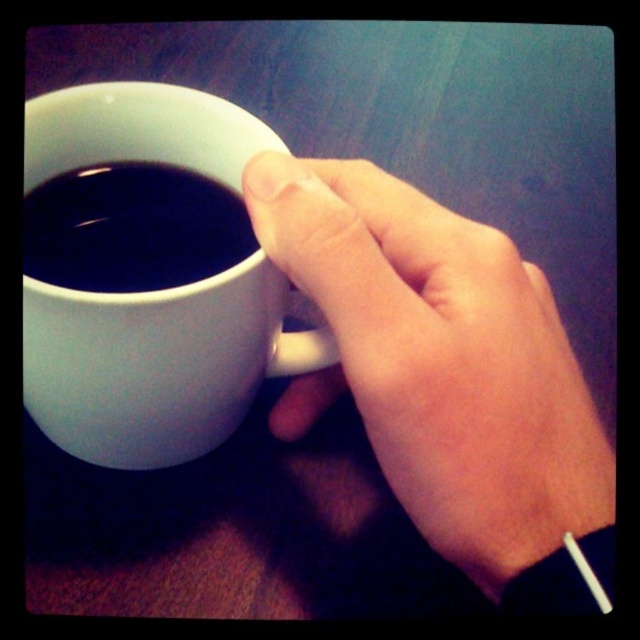
Looking at this image, you are a photographer trying to capture the black glossy mug at upper center in focus while blurring the smooth skin hand at upper center. Is this possible given their current positions?

The smooth skin hand at upper center is in front of the black glossy mug at upper center, so it would be challenging to focus on the mug while blurring the hand since they are both at the same focal plane.

You are designing a new mug that needs to fit comfortably in the palm of an average adult hand. Based on the image, does the white matte mug at center seem too large or too small for the smooth skin hand at upper center to hold comfortably?

The smooth skin hand at upper center has a smaller size compared to white matte mug at center, so the white matte mug at center may be too large for the smooth skin hand at upper center to hold comfortably.